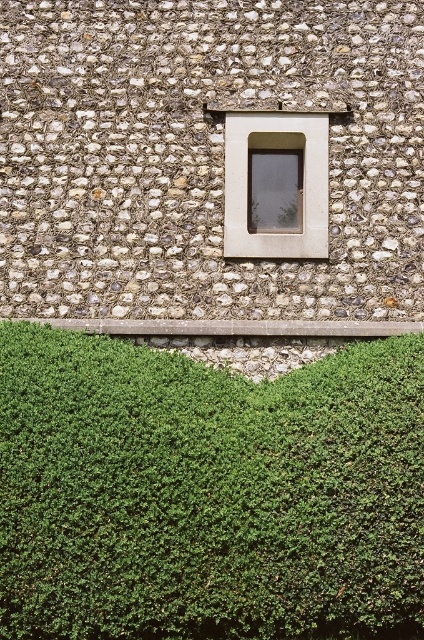
You are standing 30 feet away from the building wall. You want to check if you can see the point at point coordinates (x=70, y=566) on the wall. Based on the given information, can you see this point?

The distance of point (x=70, y=566) from camera is 28.80 feet, which is closer than your current position at 30 feet away. Therefore, you can see the point at point coordinates (x=70, y=566) on the wall.

You are a window installer assessing the exterior wall. You need to install a new window that is 1.5 meters tall. The current matte glass window at center is in the way. Can you replace it with the new window without adjusting the green leafy hedge at bottom?

The green leafy hedge at bottom is much taller than the matte glass window at center. Since the new window is 1.5 meters tall, you would need to adjust the hedge height to accommodate the taller window. Therefore, you cannot replace the window without adjusting the green leafy hedge at bottom.